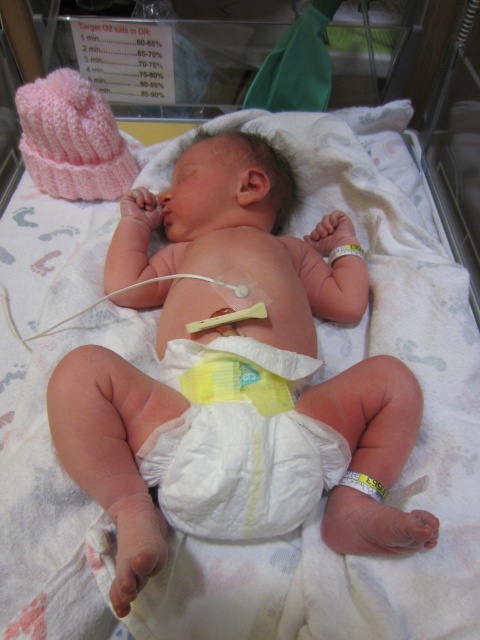
Question: Can you confirm if white cloth diaper at center is positioned above yellow rubber band at center?

Choices:
 (A) yes
 (B) no

Answer: (B)

Question: In this image, where is white cloth diaper at center located relative to yellow rubber band at center?

Choices:
 (A) left
 (B) right

Answer: (B)

Question: Among these points, which one is farthest from the camera?

Choices:
 (A) (232, 317)
 (B) (168, 435)

Answer: (A)

Question: Is white cloth diaper at center positioned before yellow rubber band at center?

Choices:
 (A) no
 (B) yes

Answer: (B)